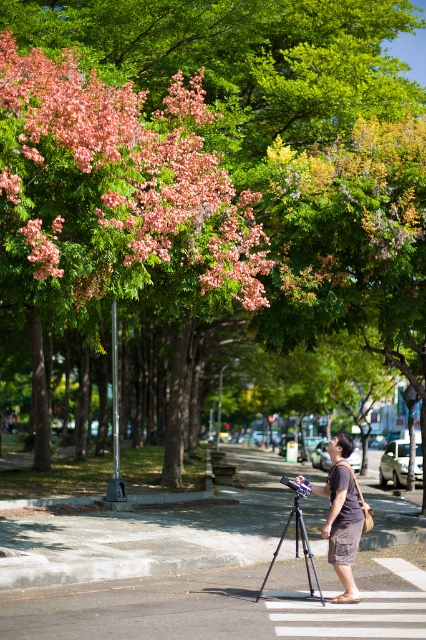
Is point (351, 556) farther from camera compared to point (305, 540)?

No, it is in front of (305, 540).

Locate an element on the screen. brown cotton shorts at lower center is located at coordinates (342, 515).

This screenshot has height=640, width=426. Find the location of `brown cotton shorts at lower center`. brown cotton shorts at lower center is located at coordinates (342, 515).